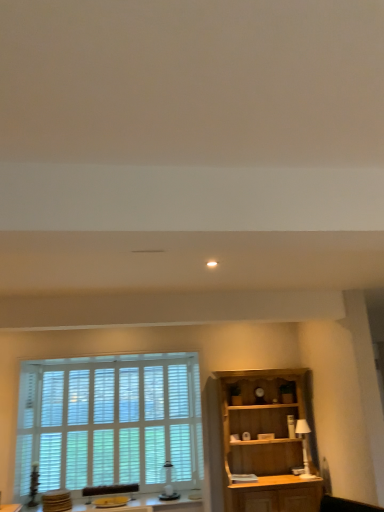
Question: Visually, is wooden cabinet at lower right positioned to the left or to the right of white wood blinds at left?

Choices:
 (A) right
 (B) left

Answer: (A)

Question: Looking at their shapes, would you say wooden cabinet at lower right is wider or thinner than white wood blinds at left?

Choices:
 (A) thin
 (B) wide

Answer: (B)

Question: Which of these objects is positioned farthest from the wooden cabinet at lower right?

Choices:
 (A) wooden swivel chair at lower left
 (B) wooden table at lower center
 (C) white glossy lamp at right
 (D) white wood blinds at left

Answer: (A)

Question: Which of these objects is positioned farthest from the wooden cabinet at lower right?

Choices:
 (A) white wood blinds at left
 (B) wooden swivel chair at lower left
 (C) wooden table at lower center
 (D) white glossy lamp at right

Answer: (B)